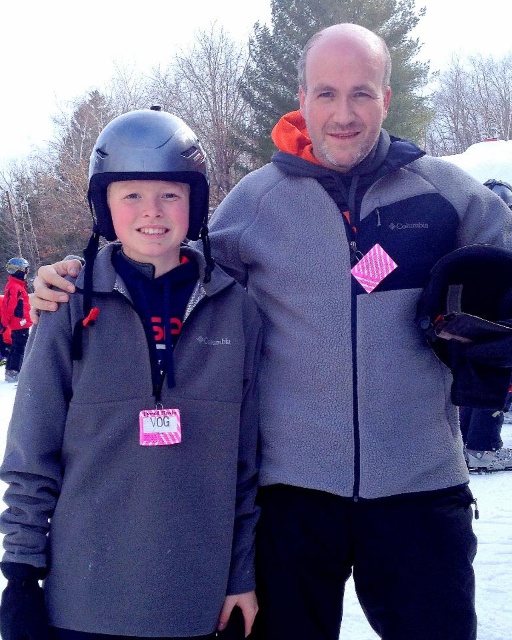
You are standing at the point marked by the coordinates point (111, 170) in a snowy area. If you want to move closer to the viewer, which direction should you move?

To move closer to the viewer from point (111, 170), you should move forward since the point is 6.88 feet away from the viewer.

You are a photographer trying to capture a group photo of the matte gray jacket at center and the matte black helmet at left. The camera you are using has a maximum focus range of 15 meters. Will both subjects be in focus if you position yourself exactly between them?

The matte gray jacket at center is 14.78 meters from the matte black helmet at left. Since the distance between them is within the camera s 15 meter focus range, positioning yourself between them would keep both subjects within the focus range, ensuring they are both in focus.

What is located at the coordinates point (136, 417) in the image?

The matte gray jacket at center is located at point (136, 417).